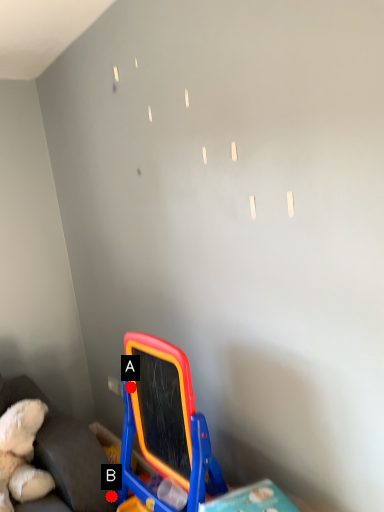
Question: Two points are circled on the image, labeled by A and B beside each circle. Which point is closer to the camera?

Choices:
 (A) A is closer
 (B) B is closer

Answer: (A)